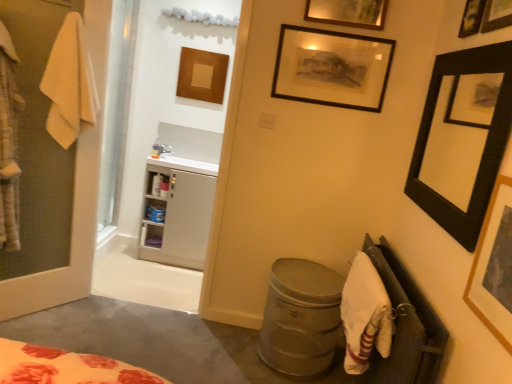
Where is `vacant region above white glossy sink at upper left (from a real-world perspective)`? vacant region above white glossy sink at upper left (from a real-world perspective) is located at coordinates (179, 157).